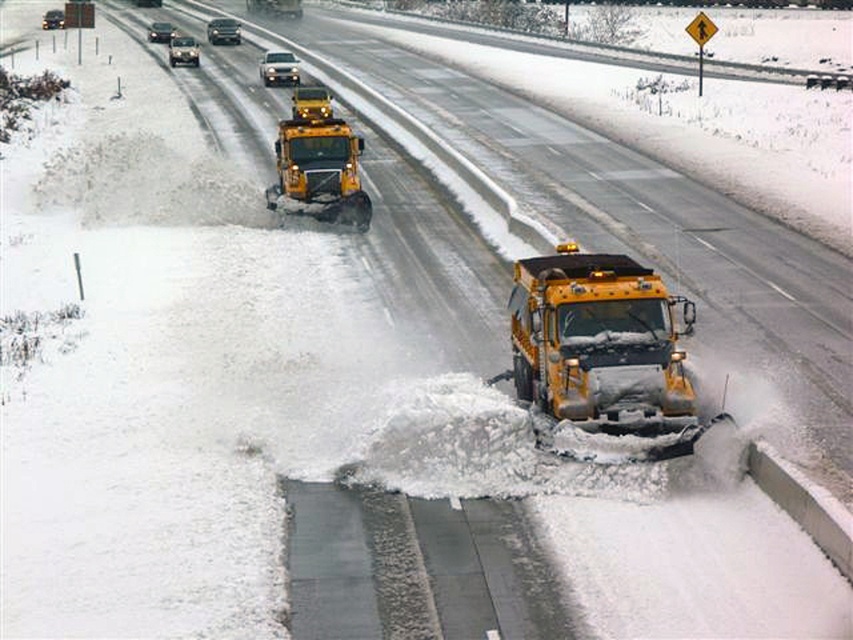
You are a driver observing the highway scene. There are two sedans, a shiny silver sedan at upper center and a metallic silver sedan at upper left. Which sedan is closer to the right edge of the road?

The shiny silver sedan at upper center is positioned on the right side of the metallic silver sedan at upper left, so it is closer to the right edge of the road.

You are a snowplow operator driving along the snowy highway. You need to reach a point closer to you to clear the snow. Which point should you head towards, point [209,22] or point [148,29]?

You should head towards point [209,22] because it is closer to the viewer than point [148,29].